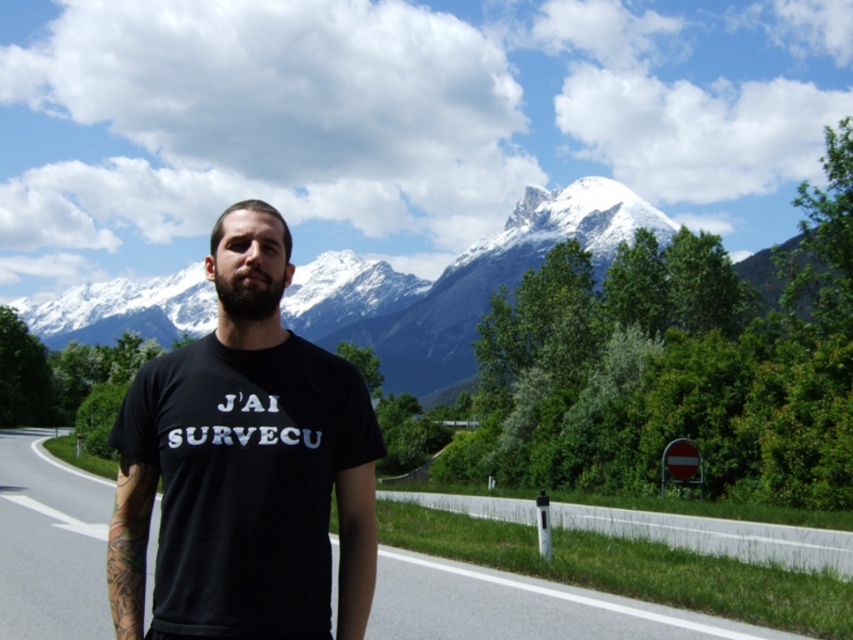
Question: Which point is farther from the camera taking this photo?

Choices:
 (A) (3, 465)
 (B) (229, 276)

Answer: (A)

Question: Does black cotton t-shirt at center have a greater width compared to dark brown fuzzy beard at center?

Choices:
 (A) yes
 (B) no

Answer: (A)

Question: Estimate the real-world distances between objects in this image. Which object is closer to the dark brown fuzzy beard at center?

Choices:
 (A) black asphalt road at center
 (B) black cotton t-shirt at center

Answer: (B)

Question: Which point is farther to the camera?

Choices:
 (A) dark brown fuzzy beard at center
 (B) black cotton t-shirt at center

Answer: (A)

Question: Is black cotton t-shirt at center bigger than dark brown fuzzy beard at center?

Choices:
 (A) no
 (B) yes

Answer: (B)

Question: Is black asphalt road at center smaller than dark brown fuzzy beard at center?

Choices:
 (A) no
 (B) yes

Answer: (A)